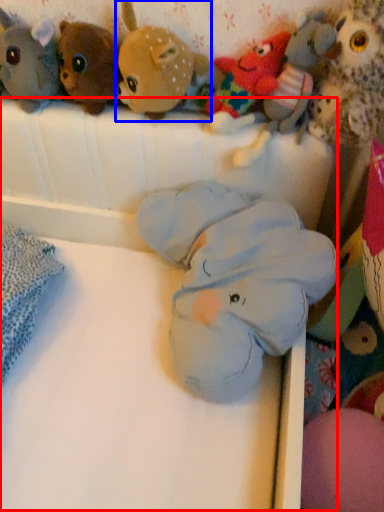
Question: Which object is closer to the camera taking this photo, infant bed (highlighted by a red box) or toy (highlighted by a blue box)?

Choices:
 (A) infant bed
 (B) toy

Answer: (A)